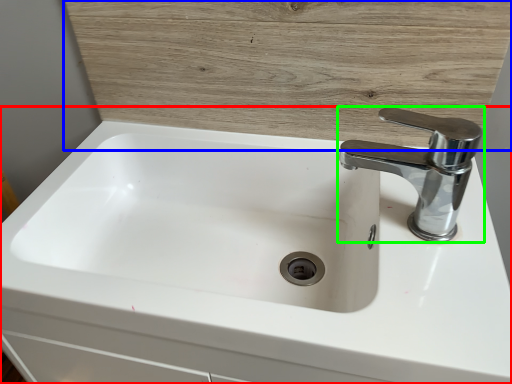
Question: Considering the real-world distances, which object is closest to sink (highlighted by a red box)? wood (highlighted by a blue box) or tap (highlighted by a green box).

Choices:
 (A) wood
 (B) tap

Answer: (A)